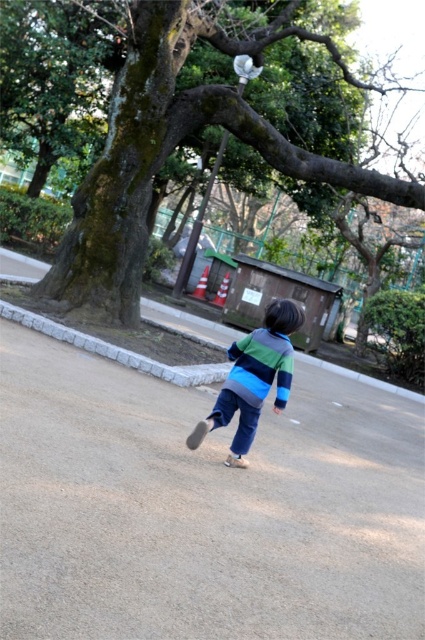
Question: Which point appears farthest from the camera in this image?

Choices:
 (A) (57, 289)
 (B) (246, 362)

Answer: (A)

Question: Is green mossy tree at upper left bigger than striped sweater at center?

Choices:
 (A) yes
 (B) no

Answer: (B)

Question: Is green mossy tree at upper left bigger than striped sweater at center?

Choices:
 (A) no
 (B) yes

Answer: (A)

Question: Can you confirm if green mossy tree at upper left is thinner than striped sweater at center?

Choices:
 (A) no
 (B) yes

Answer: (B)

Question: Which point is farther to the camera?

Choices:
 (A) [277, 300]
 (B) [135, 120]

Answer: (B)

Question: Which point is farther to the camera?

Choices:
 (A) (127, 280)
 (B) (277, 396)

Answer: (A)